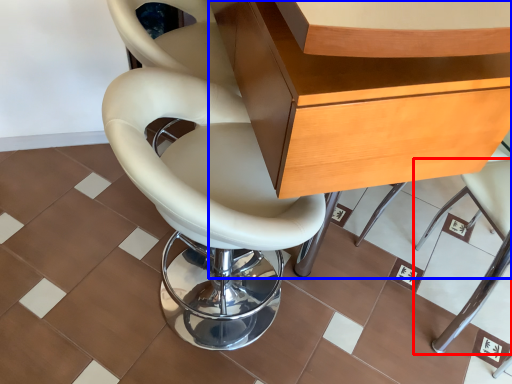
Question: Which object is further to the camera taking this photo, chair (highlighted by a red box) or desk (highlighted by a blue box)?

Choices:
 (A) chair
 (B) desk

Answer: (A)